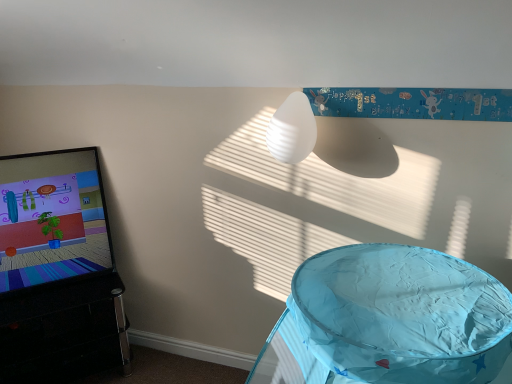
Question: Is matte black screen at left facing away from blue fabric play tent at lower right, placed as the first furniture when sorted from right to left?

Choices:
 (A) yes
 (B) no

Answer: (B)

Question: Is matte black screen at left to the left of blue fabric play tent at lower right, the 2th furniture positioned from the back, from the viewer's perspective?

Choices:
 (A) no
 (B) yes

Answer: (B)

Question: From the image's perspective, is matte black screen at left on top of blue fabric play tent at lower right, positioned as the second furniture in left-to-right order?

Choices:
 (A) no
 (B) yes

Answer: (B)

Question: Is matte black screen at left smaller than blue fabric play tent at lower right, positioned as the second furniture in left-to-right order?

Choices:
 (A) yes
 (B) no

Answer: (A)

Question: From the image's perspective, would you say matte black screen at left is shown under blue fabric play tent at lower right, positioned as the second furniture in left-to-right order?

Choices:
 (A) yes
 (B) no

Answer: (B)

Question: Can you confirm if matte black screen at left is shorter than blue fabric play tent at lower right, the 1th furniture viewed from the front?

Choices:
 (A) yes
 (B) no

Answer: (A)

Question: Is black glossy tv stand at left, placed as the second furniture when sorted from right to left, smaller than blue fabric play tent at lower right, the 1th furniture viewed from the front?

Choices:
 (A) no
 (B) yes

Answer: (B)

Question: Does black glossy tv stand at left, which is counted as the first furniture, starting from the back, appear on the right side of blue fabric play tent at lower right, the 1th furniture viewed from the front?

Choices:
 (A) yes
 (B) no

Answer: (B)

Question: Is black glossy tv stand at left, which ranks as the 1th furniture in left-to-right order, outside of blue fabric play tent at lower right, placed as the first furniture when sorted from right to left?

Choices:
 (A) yes
 (B) no

Answer: (A)

Question: Is black glossy tv stand at left, which is counted as the first furniture, starting from the back, oriented away from blue fabric play tent at lower right, the 1th furniture viewed from the front?

Choices:
 (A) yes
 (B) no

Answer: (B)

Question: Could you tell me if black glossy tv stand at left, placed as the second furniture when sorted from right to left, is facing blue fabric play tent at lower right, the 1th furniture viewed from the front?

Choices:
 (A) yes
 (B) no

Answer: (A)

Question: Is black glossy tv stand at left, placed as the second furniture when sorted from right to left, shorter than blue fabric play tent at lower right, the 1th furniture viewed from the front?

Choices:
 (A) no
 (B) yes

Answer: (B)

Question: Is matte black screen at left located outside white ribbed lampshade at upper center?

Choices:
 (A) no
 (B) yes

Answer: (B)